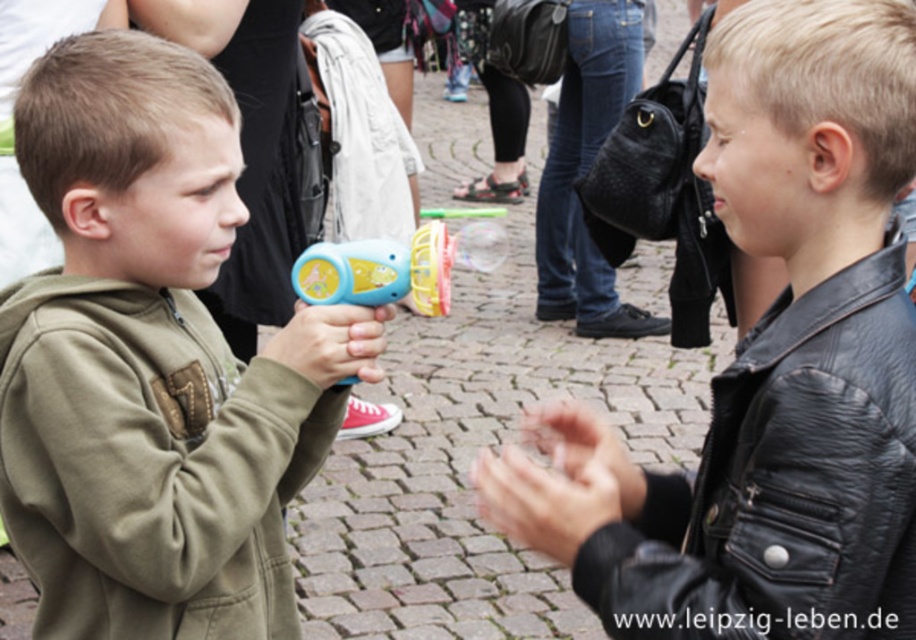
Question: Is matte black leather jacket at center positioned before matte plastic bubble gun at left?

Choices:
 (A) yes
 (B) no

Answer: (A)

Question: Is matte blue toy gun at left behind black leather jacket at right?

Choices:
 (A) no
 (B) yes

Answer: (B)

Question: Among these objects, which one is farthest from the camera?

Choices:
 (A) matte black leather jacket at center
 (B) matte blue toy gun at left
 (C) translucent plastic bubble gun at center
 (D) matte plastic bubble gun at left

Answer: (D)

Question: Estimate the real-world distances between objects in this image. Which object is closer to the matte blue toy gun at left?

Choices:
 (A) matte black leather jacket at center
 (B) matte plastic bubble gun at left
 (C) black leather jacket at right
 (D) translucent plastic bubble gun at center

Answer: (B)

Question: Is matte blue toy gun at left further to the viewer compared to matte plastic bubble gun at left?

Choices:
 (A) no
 (B) yes

Answer: (A)

Question: Among these objects, which one is nearest to the camera?

Choices:
 (A) matte black leather jacket at center
 (B) translucent plastic bubble gun at center
 (C) matte plastic bubble gun at left

Answer: (A)